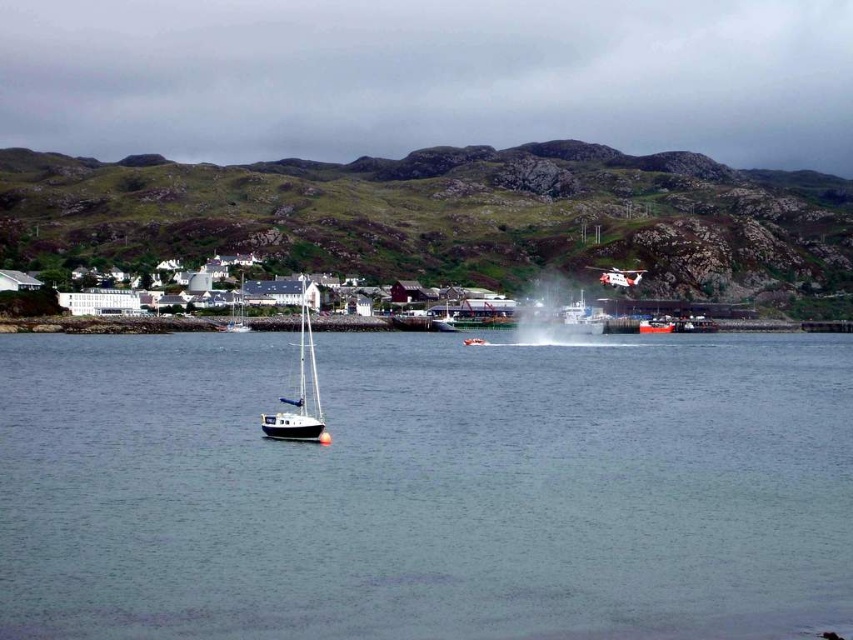
You are a marine biologist studying the spatial coordinates of vessels in the scene. The blue matte sailboat at center is at point 0.613, 0.353. If you need to place a buoy exactly 0.1 units to the north of it, what would be the new coordinate for the buoy?

The new coordinate for the buoy placed 0.1 units north of the blue matte sailboat at center would be calculated by adding 0.1 to the y coordinate. The original coordinates are (300, 392). Adding 0.1 to the y gives (386, 392). So the buoy would be at point (386, 392).

You are a photographer planning to capture both the blue matte sailboat at center and the red glossy boat at center in a single frame. Given their sizes, which boat should you focus on to ensure both are clearly visible without zooming in or out?

The blue matte sailboat at center is larger in size than the red glossy boat at center. To ensure both are clearly visible without adjusting the zoom, focus on the blue matte sailboat at center since its larger size will remain in frame while the smaller red glossy boat at center will naturally fit alongside it.

You are a sailor trying to navigate between the blue matte sailboat at center and the white glossy sailboat at center. Which boat is positioned higher in the image?

The blue matte sailboat at center is above the white glossy sailboat at center, so it is positioned higher in the image.